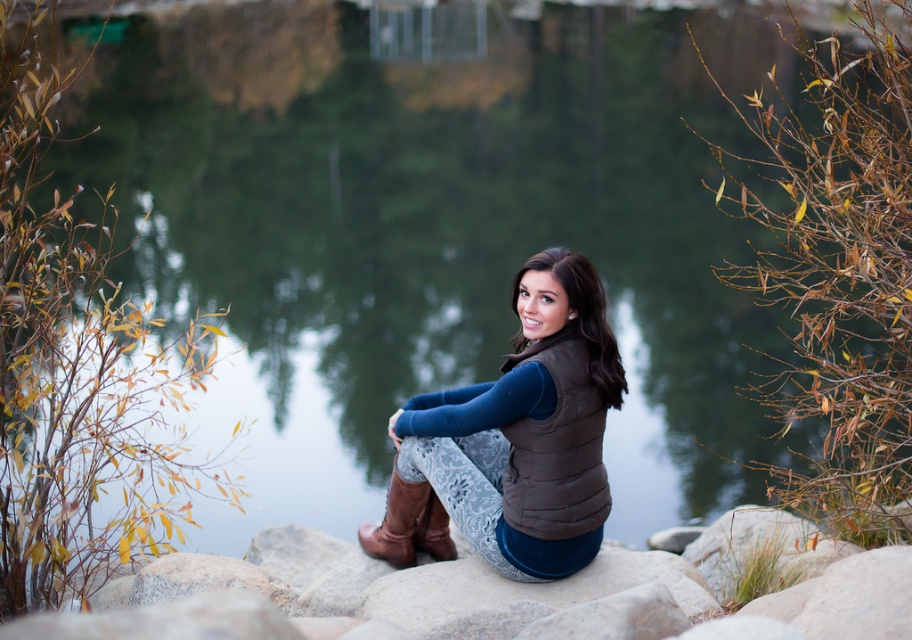
Between brown textured stone at center and brown quilted vest at center, which one is positioned lower?

Positioned lower is brown textured stone at center.

Is brown textured stone at center to the right of brown quilted vest at center from the viewer's perspective?

Yes, brown textured stone at center is to the right of brown quilted vest at center.

What do you see at coordinates (394, 600) in the screenshot?
I see `brown textured stone at center` at bounding box center [394, 600].

The height and width of the screenshot is (640, 912). I want to click on brown textured stone at center, so coord(394,600).

Does brown textured stone at center have a greater width compared to brown leather boot at lower center?

Yes, brown textured stone at center is wider than brown leather boot at lower center.

Who is shorter, brown textured stone at center or brown leather boot at lower center?

brown textured stone at center

Does point (567, 609) lie in front of point (449, 544)?

Yes.

At what (x,y) coordinates should I click in order to perform the action: click on brown textured stone at center. Please return your answer as a coordinate pair (x, y). The image size is (912, 640). Looking at the image, I should click on (394, 600).

Who is positioned more to the left, brown quilted vest at center or brown leather boot at lower center?

From the viewer's perspective, brown leather boot at lower center appears more on the left side.

Is brown quilted vest at center shorter than brown leather boot at lower center?

No.

This screenshot has height=640, width=912. Identify the location of brown quilted vest at center. (516, 438).